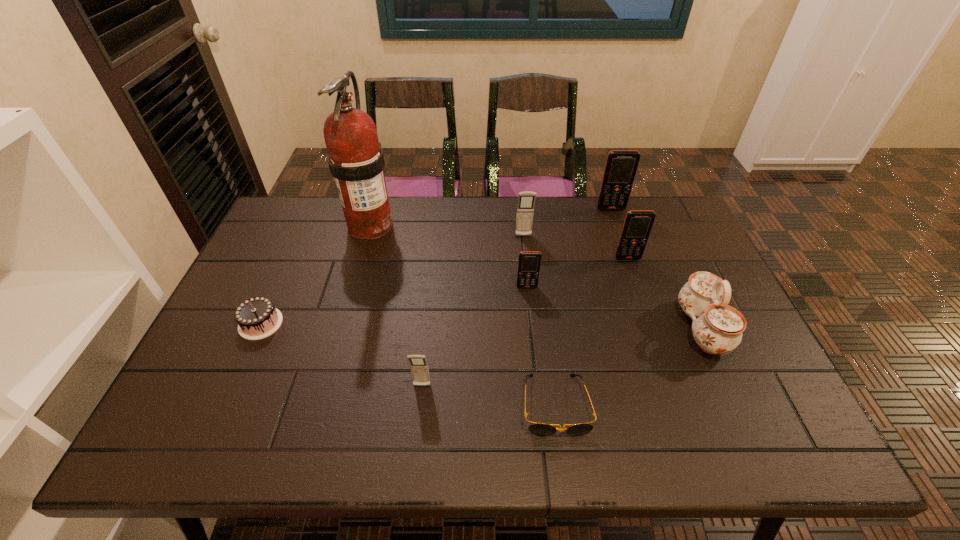
Identify the location of vacant area that lies between the third farthest cellular telephone and the sunglasses. The image size is (960, 540). (591, 332).

Identify the location of vacant area between the farthest cellular telephone and the leftmost cellular telephone. (516, 298).

Identify the location of vacant region between the leftmost object and the rightmost object. (481, 326).

Find the location of a particular element. empty location between the black sunglasses and the leftmost orange cellular telephone is located at coordinates (541, 346).

Locate an element on the screen. The height and width of the screenshot is (540, 960). vacant area that lies between the bigger gray cellular telephone and the white chinaware is located at coordinates (612, 282).

The width and height of the screenshot is (960, 540). I want to click on vacant space that's between the nearer gray cellular telephone and the leftmost orange cellular telephone, so click(x=474, y=336).

Find the location of a particular element. This screenshot has height=540, width=960. empty space that is in between the nearest cellular telephone and the bigger gray cellular telephone is located at coordinates (472, 311).

Identify which object is the second closest to the chinaware. Please provide its 2D coordinates. Your answer should be formatted as a tuple, i.e. [(x, y)], where the tuple contains the x and y coordinates of a point satisfying the conditions above.

[(542, 429)]

The width and height of the screenshot is (960, 540). In order to click on the second closest object relative to the second nearest orange cellular telephone in this screenshot , I will do `click(621, 165)`.

I want to click on the second closest cellular telephone to the tallest cellular telephone, so click(x=526, y=200).